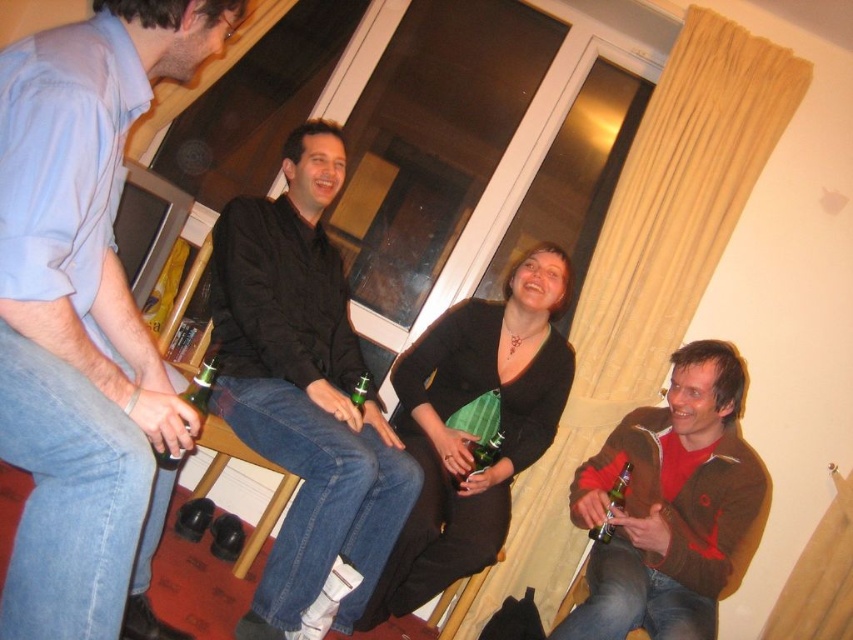
You are a photographer trying to capture a candid shot of the black matte shirt at center and the green glass bottle at lower right. To ensure both are in frame, you need to know their relative positions. Which object is located to the left of the other?

The black matte shirt at center is positioned on the left side of green glass bottle at lower right.

You are at a party and want to grab a drink. You see a green matte bottle at center and a green glass bottle at lower right. Which one is bigger?

The green glass bottle at lower right is bigger than the green matte bottle at center.